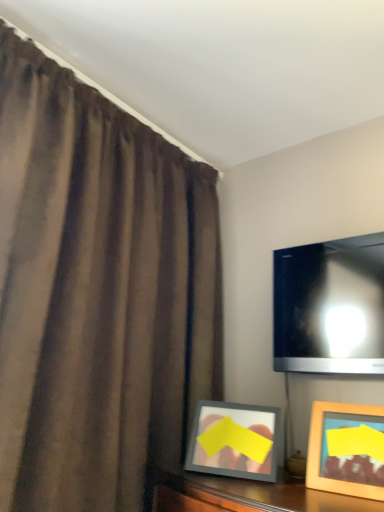
Question: In the image, is brown matte curtain at left positioned in front of or behind wooden picture frame at lower right?

Choices:
 (A) behind
 (B) front

Answer: (B)

Question: In terms of height, does brown matte curtain at left look taller or shorter compared to wooden picture frame at lower right?

Choices:
 (A) short
 (B) tall

Answer: (B)

Question: Based on their relative distances, which object is nearer to the matte black tv at upper right?

Choices:
 (A) brown matte curtain at left
 (B) wooden picture frame at lower right

Answer: (B)

Question: Estimate the real-world distances between objects in this image. Which object is closer to the wooden picture frame at lower right?

Choices:
 (A) brown matte curtain at left
 (B) matte black tv at upper right

Answer: (B)